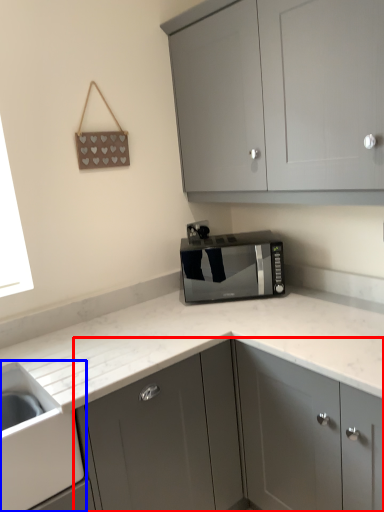
Question: Which object appears farthest to the camera in this image, cabinetry (highlighted by a red box) or sink (highlighted by a blue box)?

Choices:
 (A) cabinetry
 (B) sink

Answer: (A)